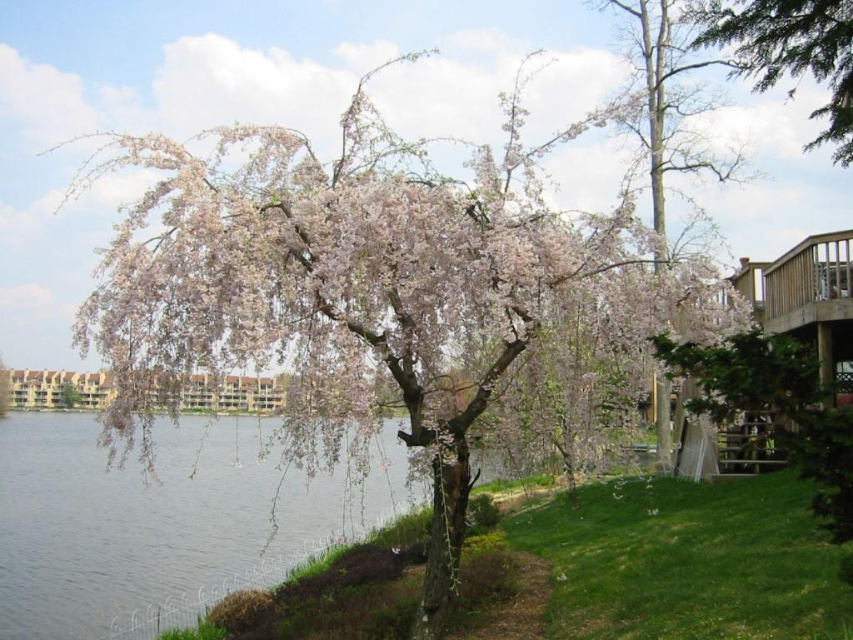
Which is in front, point (252, 529) or point (808, 72)?

Point (252, 529) is in front.

Is clear water at lower left in front of green textured tree at upper right?

Yes, clear water at lower left is closer to the viewer.

You are a GUI agent. You are given a task and a screenshot of the screen. Output one action in this format:
    pyautogui.click(x=<x>, y=<y>)
    Task: Click on the clear water at lower left
    This screenshot has width=853, height=640.
    Given the screenshot: What is the action you would take?
    pyautogui.click(x=163, y=522)